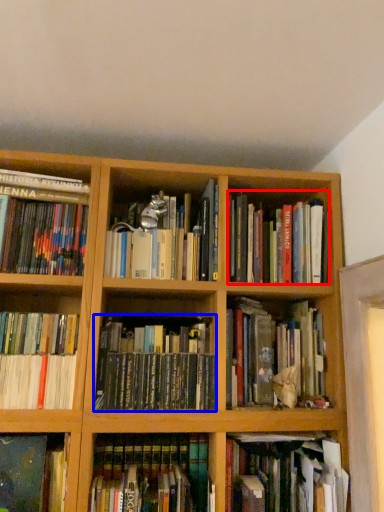
Question: Which point is further to the camera, book (highlighted by a red box) or book (highlighted by a blue box)?

Choices:
 (A) book
 (B) book

Answer: (A)